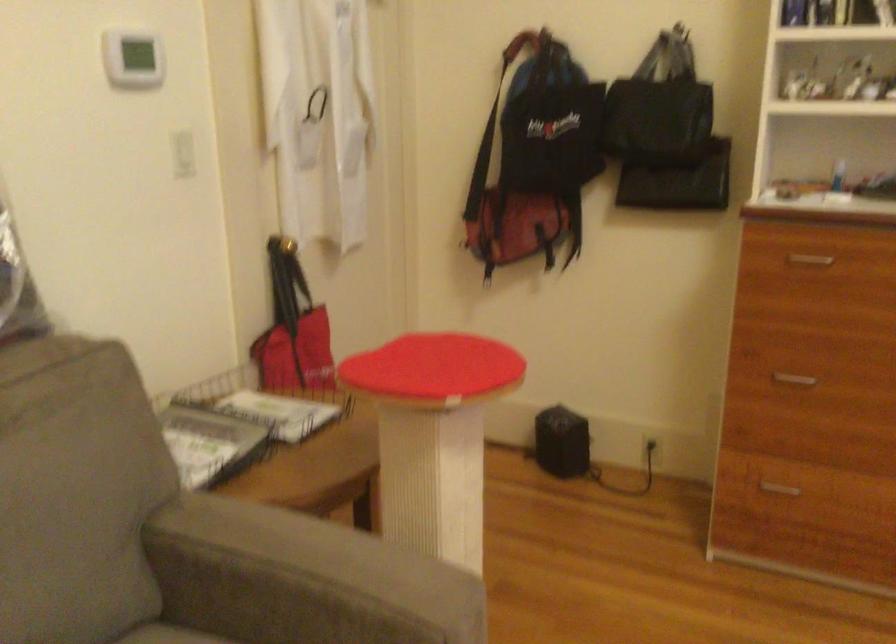
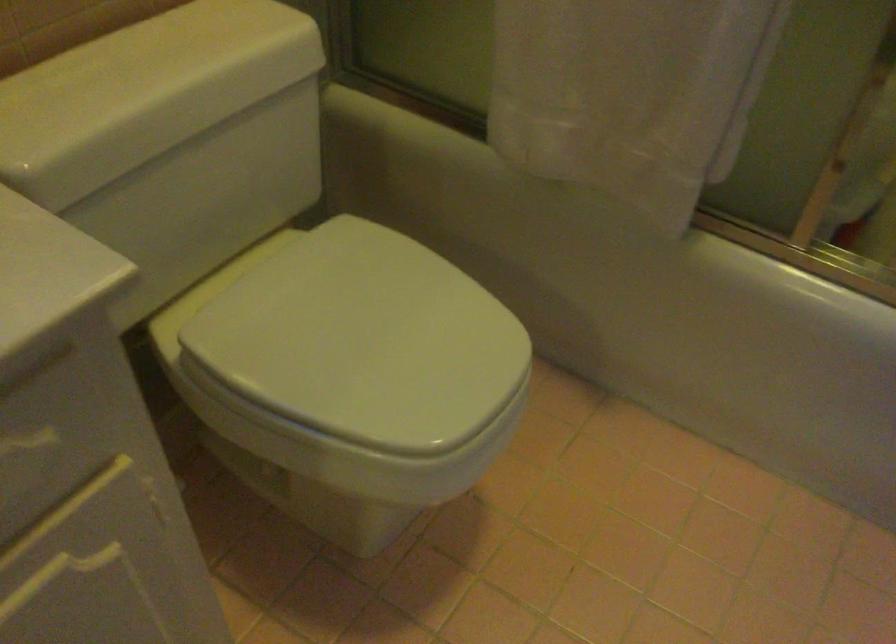
Which direction would the cameraman need to move to produce the second image?

The movement direction of the cameraman is left, backward.